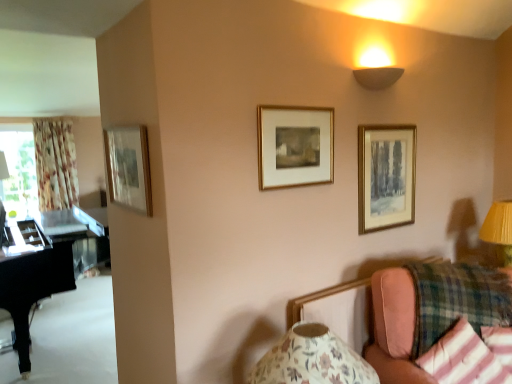
The width and height of the screenshot is (512, 384). What do you see at coordinates (499, 229) in the screenshot?
I see `yellow fabric lampshade at right, the 1th table lamp viewed from the right` at bounding box center [499, 229].

The image size is (512, 384). In order to click on yellow fabric lampshade at right, the first table lamp from the top in this screenshot , I will do `click(499, 229)`.

Locate an element on the screen. The width and height of the screenshot is (512, 384). gold wooden picture frame at center, the second picture frame in the left-to-right sequence is located at coordinates (295, 146).

Describe the element at coordinates (394, 327) in the screenshot. I see `pink fabric couch at lower right` at that location.

You are a GUI agent. You are given a task and a screenshot of the screen. Output one action in this format:
    pyautogui.click(x=<x>, y=<y>)
    Task: Click on the yellow fabric lampshade at right, the 1th table lamp viewed from the right
    This screenshot has width=512, height=384.
    Given the screenshot: What is the action you would take?
    pyautogui.click(x=499, y=229)

Is gold wooden picture frame at center, the second picture frame in the left-to-right sequence, bigger or smaller than matte beige wall sconce at upper right?

Clearly, gold wooden picture frame at center, the second picture frame in the left-to-right sequence, is larger in size than matte beige wall sconce at upper right.

Is matte beige wall sconce at upper right inside gold wooden picture frame at center, the second picture frame in the left-to-right sequence?

No, gold wooden picture frame at center, the second picture frame in the left-to-right sequence, does not contain matte beige wall sconce at upper right.

Is gold wooden picture frame at center, the 2th picture frame positioned from the right, not close to matte beige wall sconce at upper right?

That's not correct — gold wooden picture frame at center, the 2th picture frame positioned from the right, is a little close to matte beige wall sconce at upper right.

Between floral fabric curtain at left and gold-framed painting at upper right, the 3th picture frame from the left, which one has smaller size?

Smaller between the two is gold-framed painting at upper right, the 3th picture frame from the left.

Image resolution: width=512 pixels, height=384 pixels. What are the coordinates of `curtain behind the gold-framed painting at upper right, the 3th picture frame from the left` in the screenshot? It's located at (55, 164).

In the scene shown: Which is closer, (x=51, y=203) or (x=376, y=225)?

Point (x=376, y=225)

Between gold-framed mirror at upper left, which appears as the first picture frame when viewed from the left, and gold-framed painting at upper right, positioned as the first picture frame in right-to-left order, which one has less height?

gold-framed mirror at upper left, which appears as the first picture frame when viewed from the left.

From the image's perspective, is gold-framed mirror at upper left, arranged as the 3th picture frame when viewed from the right, under gold-framed painting at upper right, positioned as the first picture frame in right-to-left order?

Incorrect, from the image's perspective, gold-framed mirror at upper left, arranged as the 3th picture frame when viewed from the right, is higher than gold-framed painting at upper right, positioned as the first picture frame in right-to-left order.

Relative to gold-framed painting at upper right, the 3th picture frame from the left, is gold-framed mirror at upper left, which appears as the first picture frame when viewed from the left, in front or behind?

gold-framed mirror at upper left, which appears as the first picture frame when viewed from the left, is positioned closer to the viewer than gold-framed painting at upper right, the 3th picture frame from the left.

Would you consider gold-framed mirror at upper left, which appears as the first picture frame when viewed from the left, to be distant from gold-framed painting at upper right, the 3th picture frame from the left?

That's right, there is a large distance between gold-framed mirror at upper left, which appears as the first picture frame when viewed from the left, and gold-framed painting at upper right, the 3th picture frame from the left.

Could you tell me if striped cotton pillow at lower right, positioned as the first pillow in left-to-right order, is turned towards floral paper lampshade at lower right, the first table lamp when ordered from bottom to top?

No.

From the image's perspective, who appears lower, striped cotton pillow at lower right, positioned as the first pillow in left-to-right order, or floral paper lampshade at lower right, the first table lamp when ordered from bottom to top?

striped cotton pillow at lower right, positioned as the first pillow in left-to-right order, appears lower in the image.

Between striped cotton pillow at lower right, which is counted as the 2th pillow, starting from the right, and floral paper lampshade at lower right, acting as the 1th table lamp starting from the front, which one has larger size?

Bigger between the two is floral paper lampshade at lower right, acting as the 1th table lamp starting from the front.

Is striped cotton pillow at lower right, which is counted as the 2th pillow, starting from the right, taller than floral paper lampshade at lower right, which ranks as the 2th table lamp in top-to-bottom order?

Incorrect, the height of striped cotton pillow at lower right, which is counted as the 2th pillow, starting from the right, is not larger of that of floral paper lampshade at lower right, which ranks as the 2th table lamp in top-to-bottom order.

Can you confirm if gold-framed painting at upper right, the 3th picture frame from the left, is thinner than floral paper lampshade at lower right, acting as the 1th table lamp starting from the front?

Yes, gold-framed painting at upper right, the 3th picture frame from the left, is thinner than floral paper lampshade at lower right, acting as the 1th table lamp starting from the front.

Which is more to the left, gold-framed painting at upper right, positioned as the first picture frame in right-to-left order, or floral paper lampshade at lower right, the first table lamp when ordered from bottom to top?

floral paper lampshade at lower right, the first table lamp when ordered from bottom to top, is more to the left.

Who is shorter, gold-framed painting at upper right, the 3th picture frame from the left, or floral paper lampshade at lower right, the first table lamp when ordered from bottom to top?

floral paper lampshade at lower right, the first table lamp when ordered from bottom to top.

From a real-world perspective, is gold-framed painting at upper right, the 3th picture frame from the left, physically above floral paper lampshade at lower right, the second table lamp viewed from the right?

Yes.

Locate an element on the screen. This screenshot has width=512, height=384. table lamp behind the striped cotton pillow at lower right, which is counted as the 2th pillow, starting from the right is located at coordinates (499, 229).

How different are the orientations of striped cotton pillow at lower right, positioned as the first pillow in left-to-right order, and yellow fabric lampshade at right, the 2th table lamp ordered from the bottom, in degrees?

The facing directions of striped cotton pillow at lower right, positioned as the first pillow in left-to-right order, and yellow fabric lampshade at right, the 2th table lamp ordered from the bottom, are 63.8 degrees apart.

Which object is wider, striped cotton pillow at lower right, positioned as the first pillow in left-to-right order, or yellow fabric lampshade at right, arranged as the 1th table lamp when viewed from the back?

With larger width is yellow fabric lampshade at right, arranged as the 1th table lamp when viewed from the back.

Is striped cotton pillow at lower right, which is counted as the 2th pillow, starting from the right, taller or shorter than yellow fabric lampshade at right, the first table lamp from the top?

striped cotton pillow at lower right, which is counted as the 2th pillow, starting from the right, is shorter than yellow fabric lampshade at right, the first table lamp from the top.

Considering the positions of objects pink striped pillow at lower right, the first pillow viewed from the right, and black polished piano at left in the image provided, who is more to the left, pink striped pillow at lower right, the first pillow viewed from the right, or black polished piano at left?

black polished piano at left is more to the left.

From the image's perspective, is pink striped pillow at lower right, which is the 2th pillow from left to right, located above or below black polished piano at left?

pink striped pillow at lower right, which is the 2th pillow from left to right, is situated higher than black polished piano at left in the image.

Could black polished piano at left be considered to be inside pink striped pillow at lower right, the first pillow viewed from the right?

No, black polished piano at left is located outside of pink striped pillow at lower right, the first pillow viewed from the right.

There is a gold wooden picture frame at center, the 2th picture frame positioned from the right. What are the coordinates of `lamp above it (from a real-world perspective)` in the screenshot? It's located at (377, 77).

At what (x,y) coordinates should I click in order to perform the action: click on curtain located above the gold-framed painting at upper right, the 3th picture frame from the left (from the image's perspective). Please return your answer as a coordinate pair (x, y). Image resolution: width=512 pixels, height=384 pixels. Looking at the image, I should click on (55, 164).

Which object lies further to the anchor point pink fabric couch at lower right, floral fabric curtain at left or floral paper lampshade at lower right, which ranks as the 2th table lamp in top-to-bottom order?

floral fabric curtain at left lies further to pink fabric couch at lower right than the other object.

Based on the photo, based on their spatial positions, is black polished piano at left or striped cotton pillow at lower right, which is counted as the 2th pillow, starting from the right, further from pink striped pillow at lower right, which is the 2th pillow from left to right?

black polished piano at left is positioned further to the anchor pink striped pillow at lower right, which is the 2th pillow from left to right.

Looking at the image, which one is located closer to floral paper lampshade at lower right, acting as the 1th table lamp starting from the front, black polished piano at left or floral fabric curtain at left?

black polished piano at left is closer to floral paper lampshade at lower right, acting as the 1th table lamp starting from the front.

Looking at this image, estimate the real-world distances between objects in this image. Which object is further from floral paper lampshade at lower right, the first table lamp when ordered from bottom to top, pink fabric couch at lower right or gold-framed mirror at upper left, arranged as the 3th picture frame when viewed from the right?

gold-framed mirror at upper left, arranged as the 3th picture frame when viewed from the right.

Based on their spatial positions, is gold-framed painting at upper right, the 3th picture frame from the left, or black polished piano at left further from floral fabric curtain at left?

The object further to floral fabric curtain at left is gold-framed painting at upper right, the 3th picture frame from the left.

From the image, which object appears to be farther from floral fabric curtain at left, matte beige wall sconce at upper right or gold wooden picture frame at center, the 2th picture frame positioned from the right?

The object further to floral fabric curtain at left is matte beige wall sconce at upper right.

Estimate the real-world distances between objects in this image. Which object is further from pink fabric couch at lower right, striped cotton pillow at lower right, which is counted as the 2th pillow, starting from the right, or gold-framed painting at upper right, the 3th picture frame from the left?

Based on the image, gold-framed painting at upper right, the 3th picture frame from the left, appears to be further to pink fabric couch at lower right.

Looking at the image, which one is located closer to gold-framed mirror at upper left, arranged as the 3th picture frame when viewed from the right, gold-framed painting at upper right, positioned as the first picture frame in right-to-left order, or striped cotton pillow at lower right, which is counted as the 2th pillow, starting from the right?

gold-framed painting at upper right, positioned as the first picture frame in right-to-left order, is closer to gold-framed mirror at upper left, arranged as the 3th picture frame when viewed from the right.

You are a GUI agent. You are given a task and a screenshot of the screen. Output one action in this format:
    pyautogui.click(x=<x>, y=<y>)
    Task: Click on the studio couch between floral paper lampshade at lower right, acting as the 1th table lamp starting from the front, and pink striped pillow at lower right, the first pillow viewed from the right, from left to right
    The image size is (512, 384).
    Given the screenshot: What is the action you would take?
    pyautogui.click(x=394, y=327)

Locate an element on the screen. The width and height of the screenshot is (512, 384). pillow between pink fabric couch at lower right and pink striped pillow at lower right, which is the 2th pillow from left to right, in the front-back direction is located at coordinates (470, 356).

Image resolution: width=512 pixels, height=384 pixels. Find the location of `picture frame located between matte beige wall sconce at upper right and yellow fabric lampshade at right, the 2th table lamp positioned from the left, in the left-right direction`. picture frame located between matte beige wall sconce at upper right and yellow fabric lampshade at right, the 2th table lamp positioned from the left, in the left-right direction is located at coordinates (386, 176).

Locate an element on the screen. lamp positioned between floral paper lampshade at lower right, the first table lamp when ordered from bottom to top, and floral fabric curtain at left from near to far is located at coordinates (377, 77).